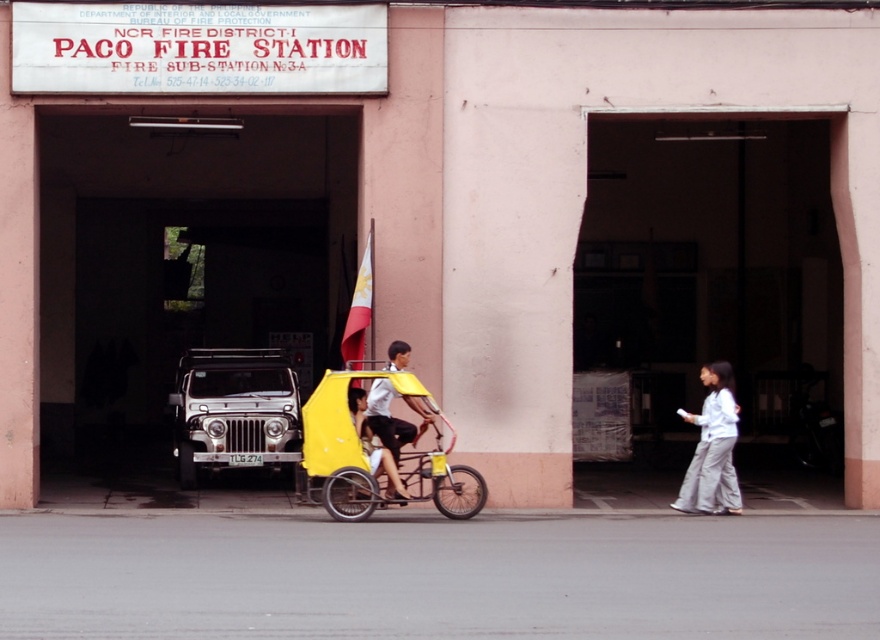
Who is more forward, (413,428) or (363,404)?

Point (363,404) is more forward.

Locate an element on the screen. yellow matte cart at center is located at coordinates (x=387, y=419).

I want to click on white fabric pants at lower right, so click(712, 449).

Who is more distant from viewer, (731,481) or (356,420)?

Positioned behind is point (731,481).

Locate an element on the screen. This screenshot has width=880, height=640. white fabric pants at lower right is located at coordinates (712, 449).

Which is above, yellow matte tricycle at center or white fabric pants at lower right?

white fabric pants at lower right is above.

Who is more distant from viewer, (356, 472) or (727, 372)?

The point (727, 372) is behind.

This screenshot has height=640, width=880. What are the coordinates of `yellow matte tricycle at center` in the screenshot? It's located at (345, 445).